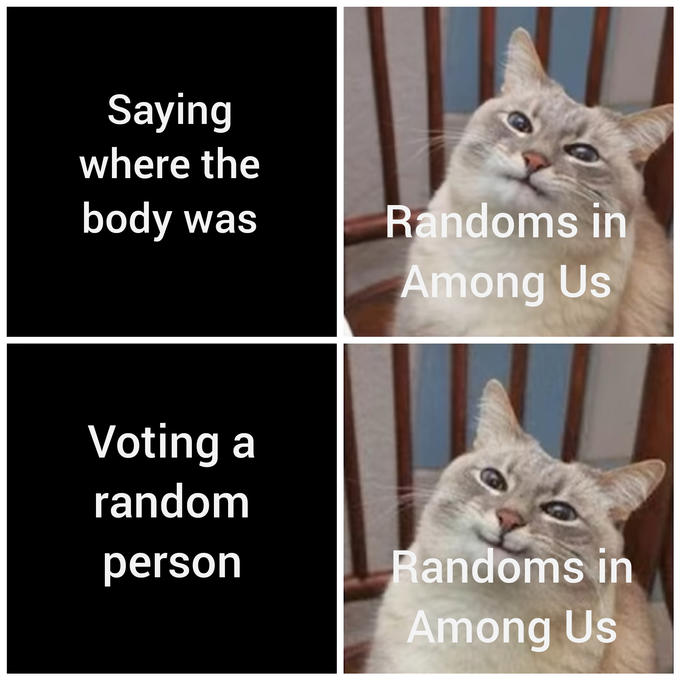
Where is `wall`? wall is located at coordinates (362, 626).